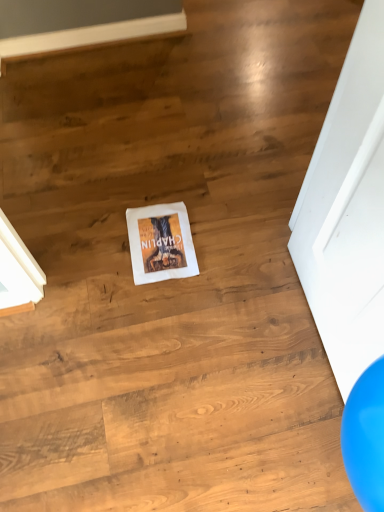
What do you see at coordinates (161, 243) in the screenshot? I see `white cloth at center` at bounding box center [161, 243].

In order to face white cloth at center, should I rotate leftwards or rightwards?

A 4.168 degree turn to the left will do.

The width and height of the screenshot is (384, 512). Identify the location of white cloth at center. (161, 243).

Where is `white matte door at center`? The width and height of the screenshot is (384, 512). white matte door at center is located at coordinates (347, 211).

What do you see at coordinates (347, 211) in the screenshot? This screenshot has width=384, height=512. I see `white matte door at center` at bounding box center [347, 211].

Find the location of `white cloth at center`. white cloth at center is located at coordinates (161, 243).

Looking at this image, which object is positioned more to the right, white matte door at center or white cloth at center?

Positioned to the right is white matte door at center.

Is white matte door at center in front of or behind white cloth at center in the image?

In the image, white matte door at center appears in front of white cloth at center.

Considering the points (349, 219) and (165, 265), which point is in front, point (349, 219) or point (165, 265)?

Positioned in front is point (349, 219).

From the image's perspective, is white matte door at center on top of white cloth at center?

No, from the image's perspective, white matte door at center is not above white cloth at center.

From a real-world perspective, is white matte door at center physically below white cloth at center?

No, from a real-world perspective, white matte door at center is not under white cloth at center.

Is white matte door at center thinner than white cloth at center?

Indeed, white matte door at center has a lesser width compared to white cloth at center.

Can you confirm if white matte door at center is shorter than white cloth at center?

In fact, white matte door at center may be taller than white cloth at center.

Is white matte door at center smaller than white cloth at center?

Incorrect, white matte door at center is not smaller in size than white cloth at center.

Is white matte door at center completely or partially outside of white cloth at center?

Yes, white matte door at center is not within white cloth at center.

Is white matte door at center in contact with white cloth at center?

white matte door at center and white cloth at center are not in contact.

Is white matte door at center oriented away from white cloth at center?

white matte door at center does not have its back to white cloth at center.

How distant is white matte door at center from white cloth at center?

white matte door at center and white cloth at center are 48.92 centimeters apart.

This screenshot has height=512, width=384. Find the location of `flyer behind the white matte door at center`. flyer behind the white matte door at center is located at coordinates (161, 243).

Looking at this image, can you confirm if white cloth at center is positioned to the left of white matte door at center?

Correct, you'll find white cloth at center to the left of white matte door at center.

Between white cloth at center and white matte door at center, which one is positioned in front?

white matte door at center is in front.

Considering the positions of point (190, 269) and point (345, 264), is point (190, 269) closer or farther from the camera than point (345, 264)?

Point (190, 269) is farther from the camera than point (345, 264).

From the image's perspective, which is below, white cloth at center or white matte door at center?

white matte door at center is shown below in the image.

From a real-world perspective, who is located higher, white cloth at center or white matte door at center?

white matte door at center, from a real-world perspective.

In terms of width, does white cloth at center look wider or thinner when compared to white matte door at center?

white cloth at center is wider than white matte door at center.

From their relative heights in the image, would you say white cloth at center is taller or shorter than white matte door at center?

white cloth at center is shorter than white matte door at center.

Does white cloth at center have a smaller size compared to white matte door at center?

Yes.

Choose the correct answer: Is white cloth at center inside white matte door at center or outside it?

white cloth at center is located beyond the bounds of white matte door at center.

Is white cloth at center with white matte door at center?

white cloth at center and white matte door at center are clearly separated.

Is white cloth at center facing away from white matte door at center?

No, white cloth at center is not facing the opposite direction of white matte door at center.

What's the angular difference between white cloth at center and white matte door at center's facing directions?

white cloth at center and white matte door at center are facing 88.8 degrees away from each other.

Where is `flyer above the white matte door at center (from the image's perspective)`? The width and height of the screenshot is (384, 512). flyer above the white matte door at center (from the image's perspective) is located at coordinates 161,243.

Locate an element on the screen. Image resolution: width=384 pixels, height=512 pixels. door that is above the white cloth at center (from a real-world perspective) is located at coordinates click(x=347, y=211).

Find the location of `flyer lying above the white matte door at center (from the image's perspective)`. flyer lying above the white matte door at center (from the image's perspective) is located at coordinates (161, 243).